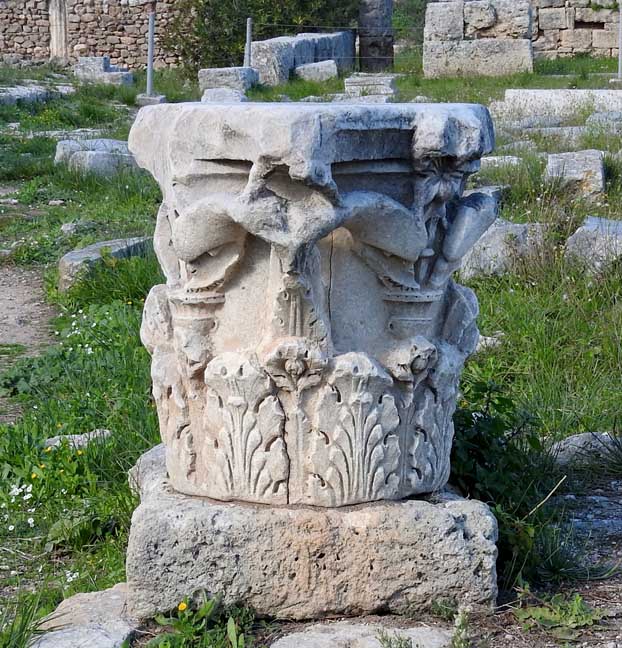
Find the location of a particular element. This screenshot has height=648, width=622. column is located at coordinates (61, 35).